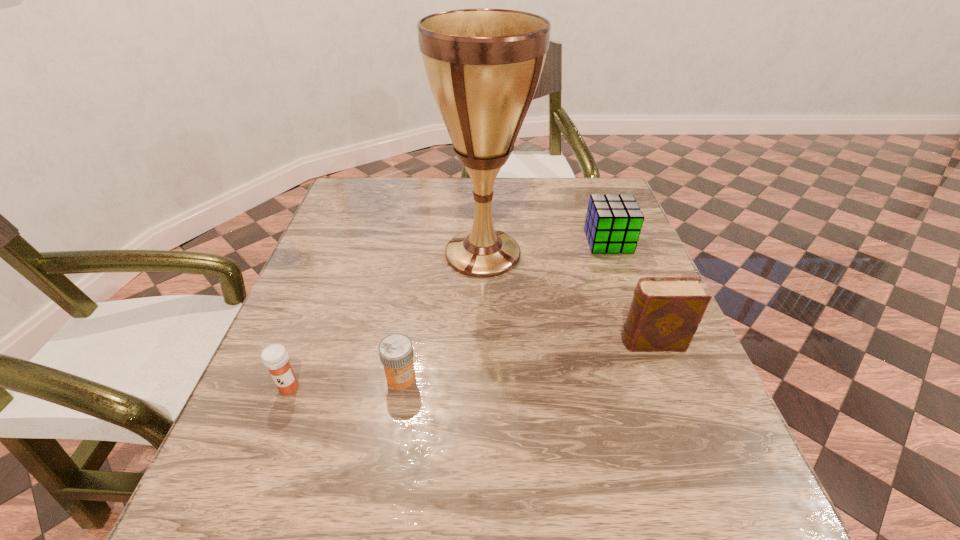
Locate an element on the screen. free spot located 0.320m on the spine side of the third farthest object is located at coordinates (460, 342).

I want to click on vacant space situated on the left of the cube, so click(497, 241).

This screenshot has width=960, height=540. Identify the location of free space located on the label side of the left medicine. (250, 489).

The height and width of the screenshot is (540, 960). I want to click on free location located on the label side of the fourth object from right to left, so click(380, 508).

Locate an element on the screen. object located in the left edge section of the desktop is located at coordinates (275, 358).

The image size is (960, 540). Identify the location of diary that is at the right edge. (665, 312).

Where is `cube that is positioned at the right edge`? The height and width of the screenshot is (540, 960). cube that is positioned at the right edge is located at coordinates (613, 223).

In order to click on free space at the far edge in this screenshot , I will do `click(459, 192)`.

Find the location of a particular element. The image size is (960, 540). vacant space at the near edge is located at coordinates (522, 506).

Identify the location of free space at the left edge of the desktop. This screenshot has width=960, height=540. (315, 249).